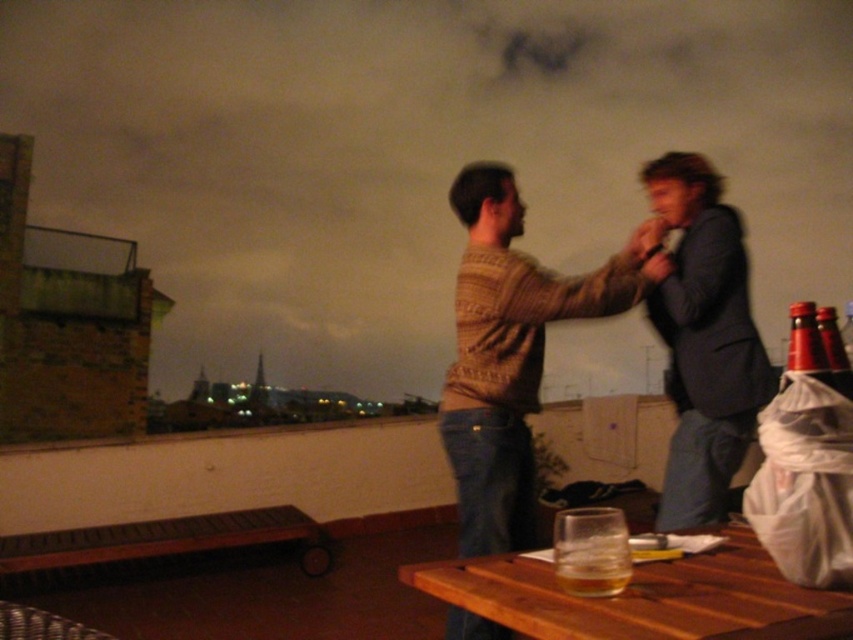
Question: Which point is closer to the camera taking this photo?

Choices:
 (A) (801, 355)
 (B) (604, 536)

Answer: (B)

Question: Which object is the closest to the brown wooden picnic table at lower left?

Choices:
 (A) wooden table at lower center
 (B) dark gray suit at right
 (C) translucent plastic bottle at right

Answer: (B)

Question: Estimate the real-world distances between objects in this image. Which object is farther from the red glass bottle at right?

Choices:
 (A) translucent glass at table center
 (B) knitted sweater at center

Answer: (B)

Question: Does knitted sweater at center have a larger size compared to red glass bottle at right?

Choices:
 (A) yes
 (B) no

Answer: (A)

Question: Considering the relative positions of knitted sweater at center and translucent glass at table center in the image provided, where is knitted sweater at center located with respect to translucent glass at table center?

Choices:
 (A) above
 (B) below

Answer: (A)

Question: Does dark gray suit at right have a lesser width compared to translucent plastic bottle at right?

Choices:
 (A) yes
 (B) no

Answer: (B)